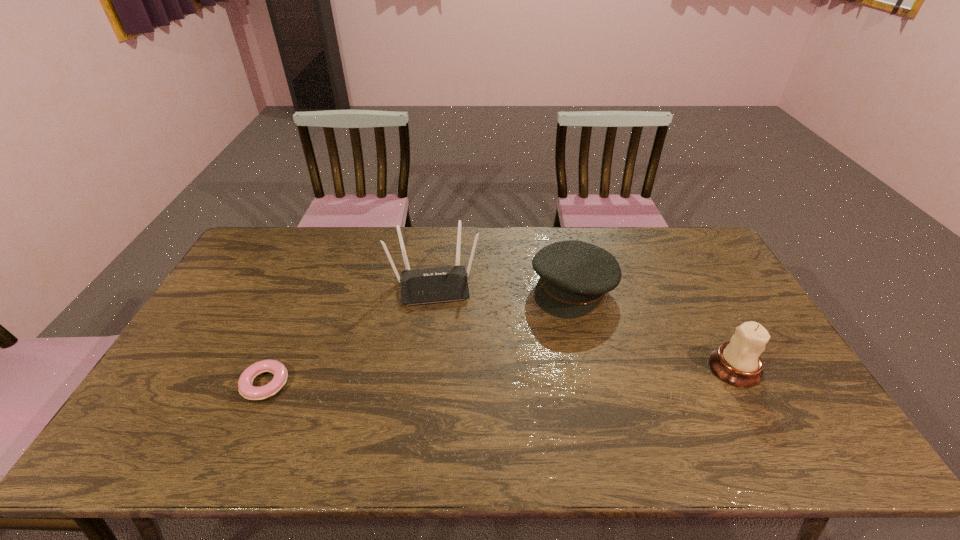
Locate an element on the screen. This screenshot has width=960, height=540. free space at the left edge of the desktop is located at coordinates (252, 323).

You are a GUI agent. You are given a task and a screenshot of the screen. Output one action in this format:
    pyautogui.click(x=<x>, y=<y>)
    Task: Click on the vacant space at the right edge
    This screenshot has height=540, width=960.
    Given the screenshot: What is the action you would take?
    pyautogui.click(x=718, y=280)

In the image, there is a desktop. At what (x,y) coordinates should I click in order to perform the action: click on vacant space at the far right corner. Please return your answer as a coordinate pair (x, y). Image resolution: width=960 pixels, height=540 pixels. Looking at the image, I should click on (668, 245).

Find the location of a particular element. unoccupied position between the rightmost object and the second object from right to left is located at coordinates (654, 328).

Where is `vacant space that is in between the third tallest object and the third object from right to left`? vacant space that is in between the third tallest object and the third object from right to left is located at coordinates tap(503, 286).

Find the location of a particular element. Image resolution: width=960 pixels, height=540 pixels. empty space between the doughnut and the router is located at coordinates (349, 334).

The height and width of the screenshot is (540, 960). Identify the location of unoccupied position between the rightmost object and the second shortest object. (654, 328).

Locate an element on the screen. empty location between the router and the candle holder is located at coordinates (585, 326).

You are a GUI agent. You are given a task and a screenshot of the screen. Output one action in this format:
    pyautogui.click(x=<x>, y=<y>)
    Task: Click on the vacant space that is in between the second object from left to right and the beret
    The image size is (960, 540).
    Given the screenshot: What is the action you would take?
    pyautogui.click(x=503, y=286)

Locate an element on the screen. The image size is (960, 540). vacant area that lies between the beret and the doughnut is located at coordinates click(419, 336).